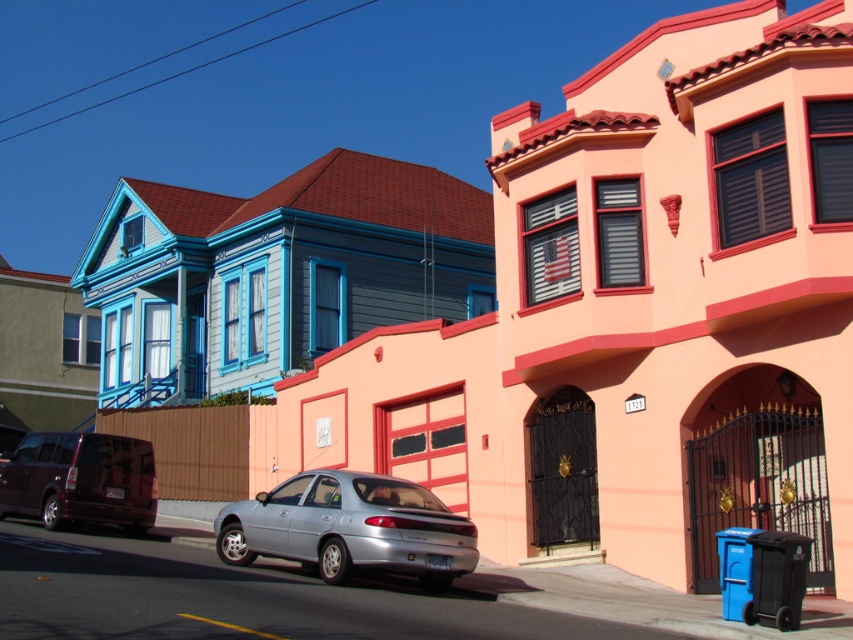
Question: Does silver metallic sedan at center appear under shiny dark purple van at lower left?

Choices:
 (A) no
 (B) yes

Answer: (B)

Question: Which of the following is the farthest from the observer?

Choices:
 (A) shiny dark purple van at lower left
 (B) silver metallic sedan at center

Answer: (A)

Question: Is silver metallic sedan at center below shiny dark purple van at lower left?

Choices:
 (A) no
 (B) yes

Answer: (B)

Question: Which point appears farthest from the camera in this image?

Choices:
 (A) (82, 513)
 (B) (224, 513)

Answer: (A)

Question: Is silver metallic sedan at center behind shiny dark purple van at lower left?

Choices:
 (A) no
 (B) yes

Answer: (A)